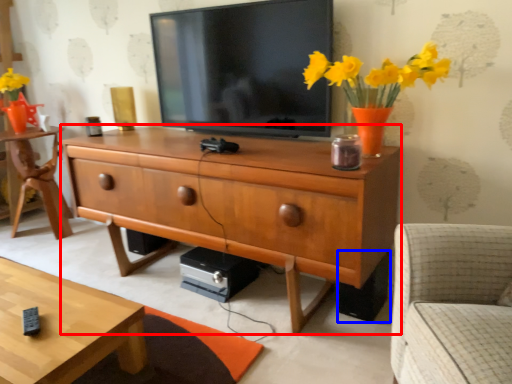
Question: Which of the following is the closest to the observer, chest of drawers (highlighted by a red box) or speaker (highlighted by a blue box)?

Choices:
 (A) chest of drawers
 (B) speaker

Answer: (A)